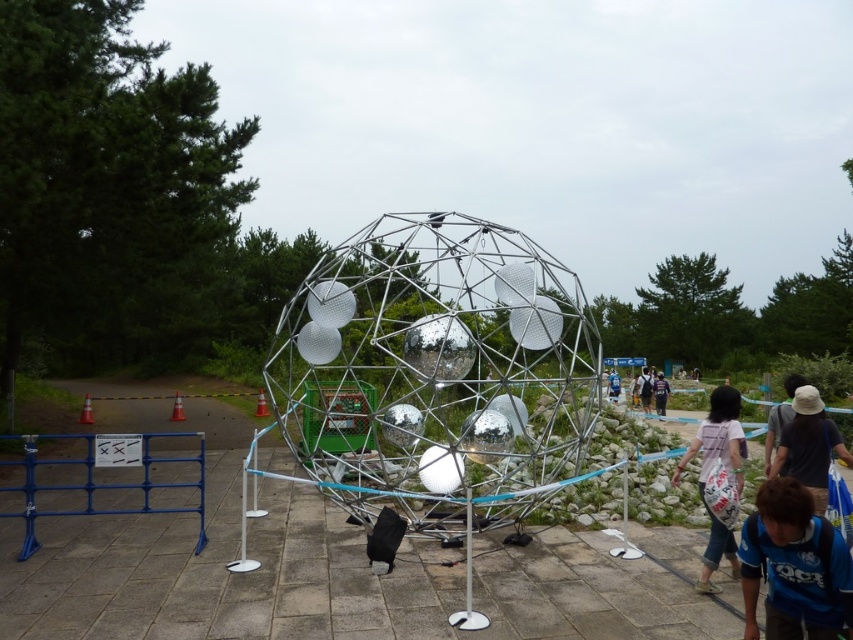
Looking at this image, measure the distance between point (717,452) and camera.

Point (717,452) is 5.79 meters away from camera.

Can you confirm if white fabric bag at lower right is thinner than dark blue shirt at center?

Yes.

Where is `white fabric bag at lower right`? The width and height of the screenshot is (853, 640). white fabric bag at lower right is located at coordinates (708, 472).

Is point (769, 540) positioned after point (653, 392)?

No, it is in front of (653, 392).

Who is positioned more to the left, blue jersey at center or purple fabric bag at center?

blue jersey at center is more to the left.

Between point (775, 516) and point (665, 401), which one is positioned in front?

Positioned in front is point (775, 516).

Identify the location of blue jersey at center. The image size is (853, 640). (793, 566).

Does dark gray fabric bag at lower right have a larger size compared to purple fabric bag at center?

Incorrect, dark gray fabric bag at lower right is not larger than purple fabric bag at center.

Which is more to the left, dark gray fabric bag at lower right or purple fabric bag at center?

dark gray fabric bag at lower right is more to the left.

Is point (810, 440) less distant than point (665, 404)?

Yes, point (810, 440) is closer to viewer.

The height and width of the screenshot is (640, 853). What are the coordinates of `dark gray fabric bag at lower right` in the screenshot? It's located at (808, 445).